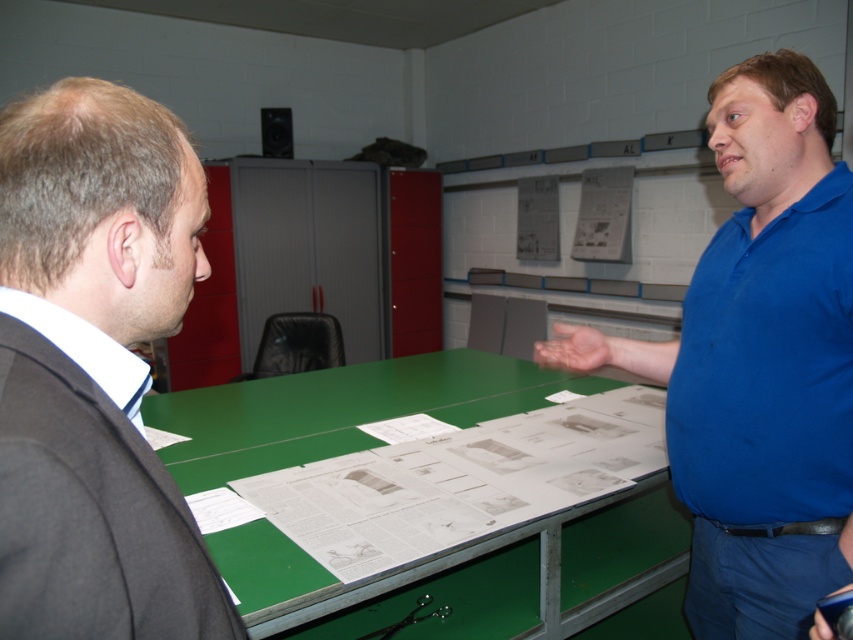
You are a photographer standing in front of the dark gray suit at left. You want to take a closeup photo of the suit without moving any objects. Can you get close enough to take the photo?

The dark gray suit at left and viewer are 15.42 inches apart, so yes, you can get close enough to take the photo as the distance is sufficient for a closeup.